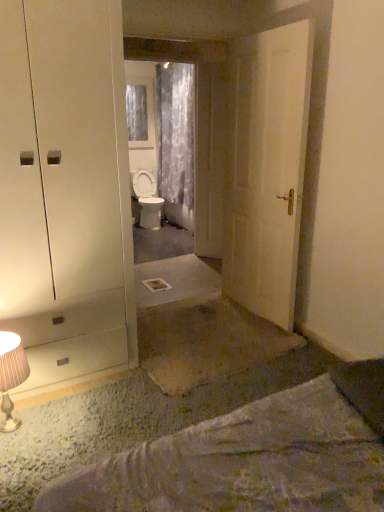
Question: Based on their positions, is white matte door at center, the first door positioned from the front, located to the left or right of metallic beige table lamp at lower left?

Choices:
 (A) left
 (B) right

Answer: (B)

Question: Considering the positions of point (286, 207) and point (14, 378), is point (286, 207) closer or farther from the camera than point (14, 378)?

Choices:
 (A) closer
 (B) farther

Answer: (B)

Question: Which object is positioned farthest from the wooden door at center, arranged as the 1th door when viewed from the left?

Choices:
 (A) translucent floral fabric curtain at center
 (B) transparent plastic window at upper center
 (C) transparent glass mirror at center
 (D) metallic beige table lamp at lower left
 (E) white glossy toilet at center

Answer: (B)

Question: Estimate the real-world distances between objects in this image. Which object is closer to the metallic beige table lamp at lower left?

Choices:
 (A) wooden door at center, the 2th door positioned from the front
 (B) white matte door at center, marked as the first door in a right-to-left arrangement
 (C) transparent plastic window at upper center
 (D) translucent floral fabric curtain at center
 (E) white glossy toilet at center

Answer: (B)